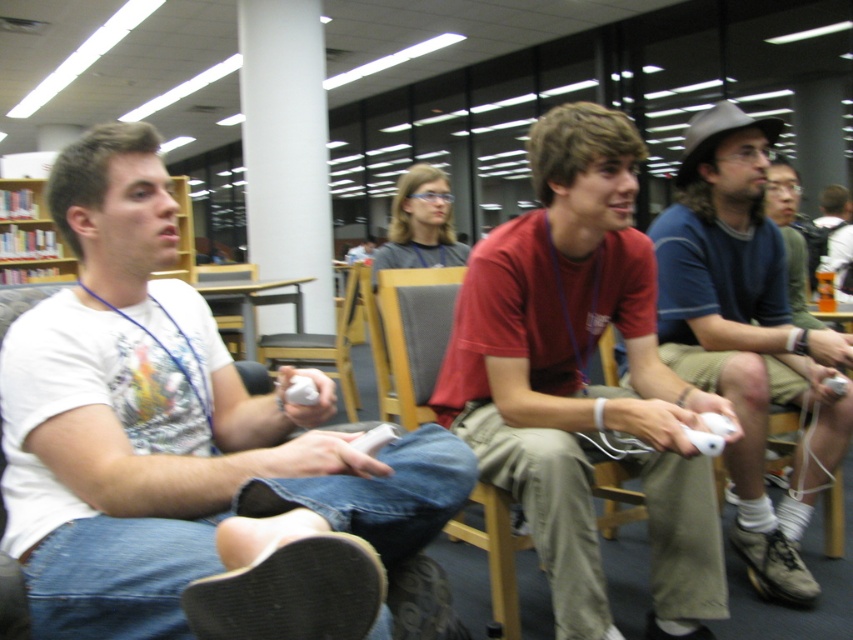
You are a photographer trying to capture a group photo of the white matte shirt at left and the matte blue shirt at center. Since you want to ensure both subjects are in focus, you need to know their heights. Which one is shorter?

The white matte shirt at left is shorter than the matte blue shirt at center.

You are a person standing behind the white matte shirt at left and the matte blue shirt at center. Which of the two men is closer to you?

The white matte shirt at left is closer to you because it is in front of the matte blue shirt at center.

You are standing in the library and see two points marked on the floor. The first point is at coordinate point (811, 429) and the second point is at coordinate point (434, 333). Which point is closer to you?

Point (811, 429) is further to the camera than point (434, 333), so the point closer to you is point (434, 333).